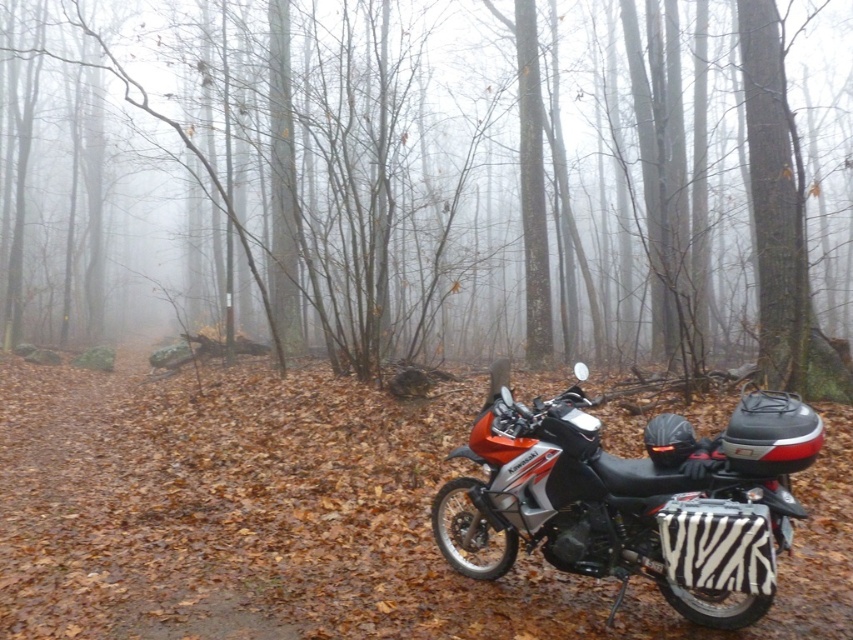
Question: Which object appears closest to the camera in this image?

Choices:
 (A) zebra-patterned side bag at lower right
 (B) brown matte tree at center

Answer: (A)

Question: Is brown matte tree at center positioned at the back of zebra-patterned side bag at lower right?

Choices:
 (A) yes
 (B) no

Answer: (A)

Question: Is brown matte tree at center wider than zebra-patterned side bag at lower right?

Choices:
 (A) no
 (B) yes

Answer: (B)

Question: Among these objects, which one is nearest to the camera?

Choices:
 (A) zebra-patterned side bag at lower right
 (B) brown matte tree at center

Answer: (A)

Question: Can you confirm if brown matte tree at center is positioned below zebra-patterned side bag at lower right?

Choices:
 (A) no
 (B) yes

Answer: (A)